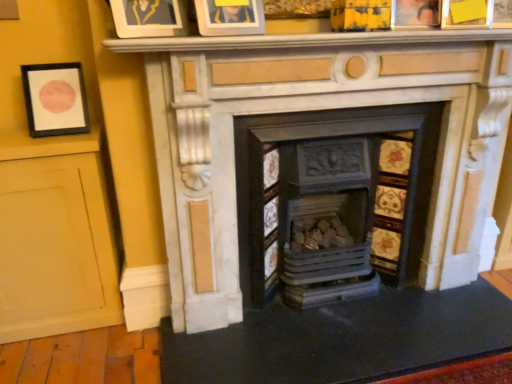
Question: Is white marble fireplace at center, arranged as the first fireplace when viewed from the right, shorter than wooden photo frame at upper right, the 3th picture frame positioned from the left?

Choices:
 (A) yes
 (B) no

Answer: (B)

Question: Considering the relative sizes of white marble fireplace at center, which is the second fireplace in left-to-right order, and wooden photo frame at upper right, the 3th picture frame positioned from the left, in the image provided, is white marble fireplace at center, which is the second fireplace in left-to-right order, bigger than wooden photo frame at upper right, the 3th picture frame positioned from the left,?

Choices:
 (A) no
 (B) yes

Answer: (B)

Question: From the image's perspective, is white marble fireplace at center, which is the second fireplace in left-to-right order, beneath wooden photo frame at upper right, the 3th picture frame positioned from the left?

Choices:
 (A) no
 (B) yes

Answer: (B)

Question: Can you confirm if white marble fireplace at center, arranged as the first fireplace when viewed from the right, is positioned to the left of wooden photo frame at upper right, which is counted as the second picture frame, starting from the right?

Choices:
 (A) yes
 (B) no

Answer: (A)

Question: From a real-world perspective, is white marble fireplace at center, arranged as the first fireplace when viewed from the right, positioned over wooden photo frame at upper right, the 3th picture frame positioned from the left, based on gravity?

Choices:
 (A) no
 (B) yes

Answer: (A)

Question: Considering the positions of point click(224, 114) and point click(290, 233), is point click(224, 114) closer or farther from the camera than point click(290, 233)?

Choices:
 (A) farther
 (B) closer

Answer: (B)

Question: Considering their positions, is white marble fireplace at center, which is the second fireplace in left-to-right order, located in front of or behind rustic wood logs at center, positioned as the first fireplace in left-to-right order?

Choices:
 (A) behind
 (B) front

Answer: (B)

Question: In terms of size, does white marble fireplace at center, arranged as the first fireplace when viewed from the right, appear bigger or smaller than rustic wood logs at center, positioned as the first fireplace in left-to-right order?

Choices:
 (A) small
 (B) big

Answer: (B)

Question: From a real-world perspective, relative to rustic wood logs at center, which is the 2th fireplace from right to left, is white marble fireplace at center, arranged as the first fireplace when viewed from the right, vertically above or below?

Choices:
 (A) below
 (B) above

Answer: (B)

Question: In terms of size, does matte gold picture frame at upper center, the 3th picture frame in the right-to-left sequence, appear bigger or smaller than white marble fireplace at center, which is the second fireplace in left-to-right order?

Choices:
 (A) small
 (B) big

Answer: (A)

Question: Would you say matte gold picture frame at upper center, the 3th picture frame in the right-to-left sequence, is inside or outside white marble fireplace at center, which is the second fireplace in left-to-right order?

Choices:
 (A) outside
 (B) inside

Answer: (A)

Question: Relative to white marble fireplace at center, arranged as the first fireplace when viewed from the right, is matte gold picture frame at upper center, the 3th picture frame in the right-to-left sequence, in front or behind?

Choices:
 (A) front
 (B) behind

Answer: (A)

Question: Is matte gold picture frame at upper center, the 3th picture frame in the right-to-left sequence, taller or shorter than white marble fireplace at center, which is the second fireplace in left-to-right order?

Choices:
 (A) tall
 (B) short

Answer: (B)

Question: Relative to rustic wood logs at center, which is the 2th fireplace from right to left, is matte gold picture frame at upper center, the 3th picture frame in the right-to-left sequence, in front or behind?

Choices:
 (A) front
 (B) behind

Answer: (A)

Question: Would you say matte gold picture frame at upper center, which ranks as the second picture frame in left-to-right order, is inside or outside rustic wood logs at center, which is the 2th fireplace from right to left?

Choices:
 (A) outside
 (B) inside

Answer: (A)